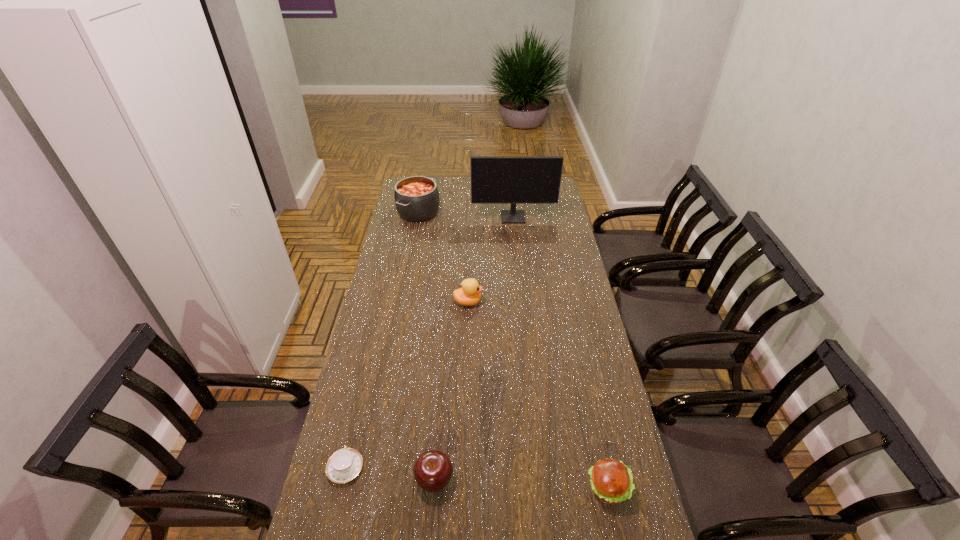
In the image, there is a desktop. Where is `free space at the left edge`? This screenshot has height=540, width=960. free space at the left edge is located at coordinates (338, 535).

Locate an element on the screen. This screenshot has width=960, height=540. free region at the right edge of the desktop is located at coordinates (587, 339).

You are a GUI agent. You are given a task and a screenshot of the screen. Output one action in this format:
    pyautogui.click(x=<x>, y=<y>)
    Task: Click on the free space between the apple and the hamburger
    
    Given the screenshot: What is the action you would take?
    pyautogui.click(x=521, y=484)

This screenshot has height=540, width=960. In order to click on blank region between the computer monitor and the hamburger in this screenshot , I will do `click(561, 353)`.

The image size is (960, 540). I want to click on free spot between the hamburger and the apple, so click(x=521, y=484).

Image resolution: width=960 pixels, height=540 pixels. I want to click on vacant point located between the fifth shortest object and the apple, so click(x=426, y=346).

Locate an element on the screen. The image size is (960, 540). free space between the tallest object and the apple is located at coordinates (474, 349).

Locate an element on the screen. This screenshot has width=960, height=540. empty space that is in between the teacup and the third farthest object is located at coordinates (407, 385).

Locate an element on the screen. This screenshot has height=540, width=960. unoccupied area between the duckling and the casserole is located at coordinates (444, 257).

Locate an element on the screen. The height and width of the screenshot is (540, 960). unoccupied position between the shortest object and the apple is located at coordinates (390, 474).